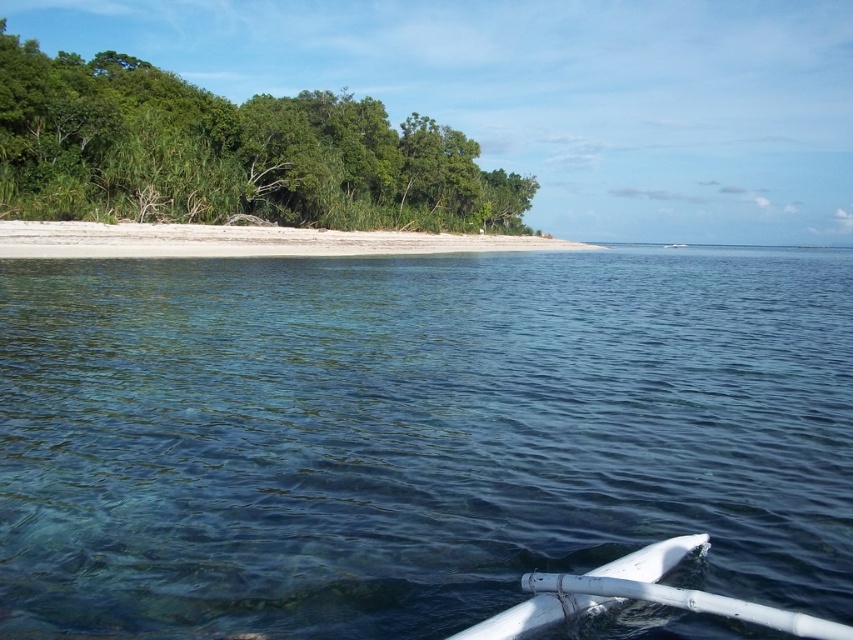
Measure the distance between green leafy trees at left and camera.

green leafy trees at left and camera are 35.71 meters apart from each other.

Does green leafy trees at left lie behind white sand beach at center?

Yes, it is behind white sand beach at center.

Which is behind, point (436, 163) or point (143, 246)?

Point (436, 163)

Identify the location of green leafy trees at left. (227, 152).

Which is above, clear blue water at center or white sand beach at center?

Positioned higher is white sand beach at center.

Which is below, clear blue water at center or white sand beach at center?

Positioned lower is clear blue water at center.

Who is more forward, (757, 630) or (251, 248)?

Point (757, 630)

This screenshot has height=640, width=853. Identify the location of clear blue water at center. (415, 435).

Describe the element at coordinates (415, 435) in the screenshot. I see `clear blue water at center` at that location.

Is point (114, 296) positioned in front of point (541, 577)?

No, it is behind (541, 577).

The width and height of the screenshot is (853, 640). Find the location of `clear blue water at center`. clear blue water at center is located at coordinates (415, 435).